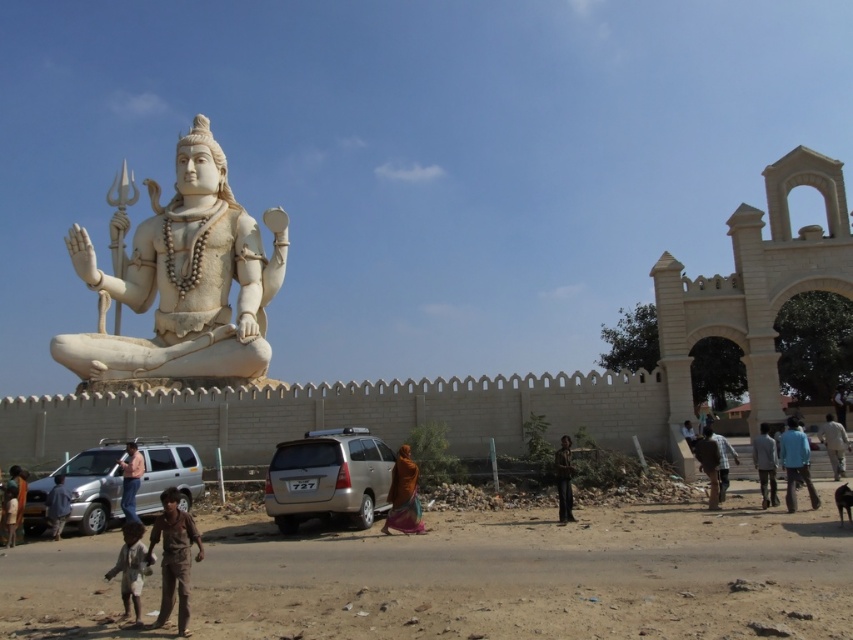
Is blue cotton shirt at lower right to the right of dark blue shirt at lower right from the viewer's perspective?

Correct, you'll find blue cotton shirt at lower right to the right of dark blue shirt at lower right.

Which of these two, blue cotton shirt at lower right or dark blue shirt at lower right, stands shorter?

Standing shorter between the two is dark blue shirt at lower right.

Is point (816, 493) less distant than point (701, 445)?

Yes, it is.

This screenshot has width=853, height=640. What are the coordinates of `blue cotton shirt at lower right` in the screenshot? It's located at (795, 464).

Is point (399, 458) in front of point (688, 429)?

Yes, it is.

Can you confirm if orange fabric at center is positioned to the right of light brown fabric shirt at center?

Incorrect, orange fabric at center is not on the right side of light brown fabric shirt at center.

Who is more forward, (387, 515) or (688, 419)?

Point (387, 515) is in front.

Identify the location of orange fabric at center. (403, 496).

Does point (846, 616) come behind point (15, 486)?

No, (846, 616) is closer to viewer.

Where is `dirt field at lower center`? Image resolution: width=853 pixels, height=640 pixels. dirt field at lower center is located at coordinates (537, 577).

Where is `dirt field at lower center`? The image size is (853, 640). dirt field at lower center is located at coordinates (537, 577).

Locate an element on the screen. Image resolution: width=853 pixels, height=640 pixels. dirt field at lower center is located at coordinates (537, 577).